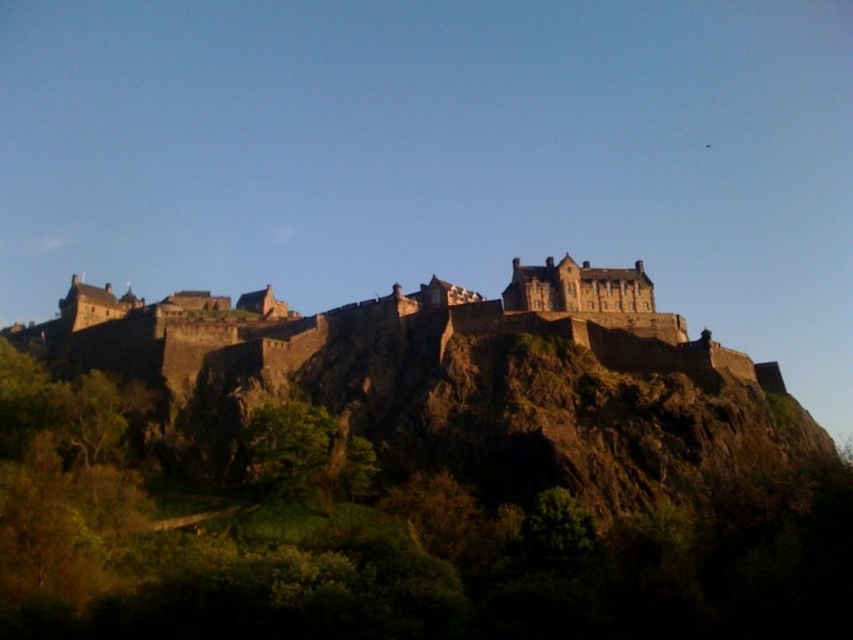
Question: Is brown rocky hillside at center in front of brown stone castle at center?

Choices:
 (A) yes
 (B) no

Answer: (A)

Question: Which of the following is the closest to the observer?

Choices:
 (A) brown rocky hillside at center
 (B) brown stone castle at center

Answer: (A)

Question: Which object appears farthest from the camera in this image?

Choices:
 (A) brown rocky hillside at center
 (B) brown stone castle at center

Answer: (B)

Question: Can you confirm if brown rocky hillside at center is positioned below brown stone castle at center?

Choices:
 (A) no
 (B) yes

Answer: (B)

Question: Is the position of brown rocky hillside at center less distant than that of brown stone castle at center?

Choices:
 (A) yes
 (B) no

Answer: (A)